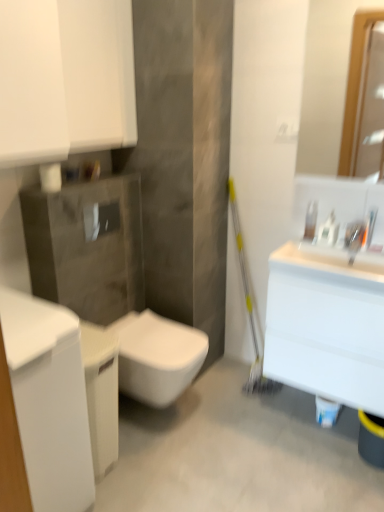
Identify the location of free space underneath white glossy toilet at center (from a real-world perspective). The height and width of the screenshot is (512, 384). (163, 415).